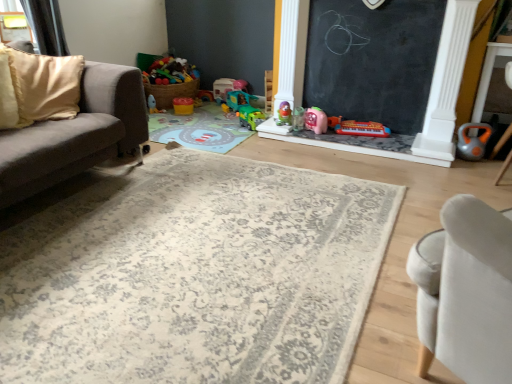
The image size is (512, 384). In order to click on vacant space situated above beige floral rug at center (from a real-world perspective) in this screenshot , I will do `click(168, 239)`.